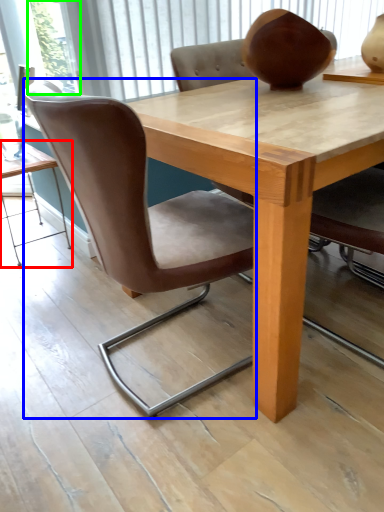
Question: Which object is the farthest from table (highlighted by a red box)? Choose among these: chair (highlighted by a blue box) or glass door (highlighted by a green box).

Choices:
 (A) chair
 (B) glass door

Answer: (A)